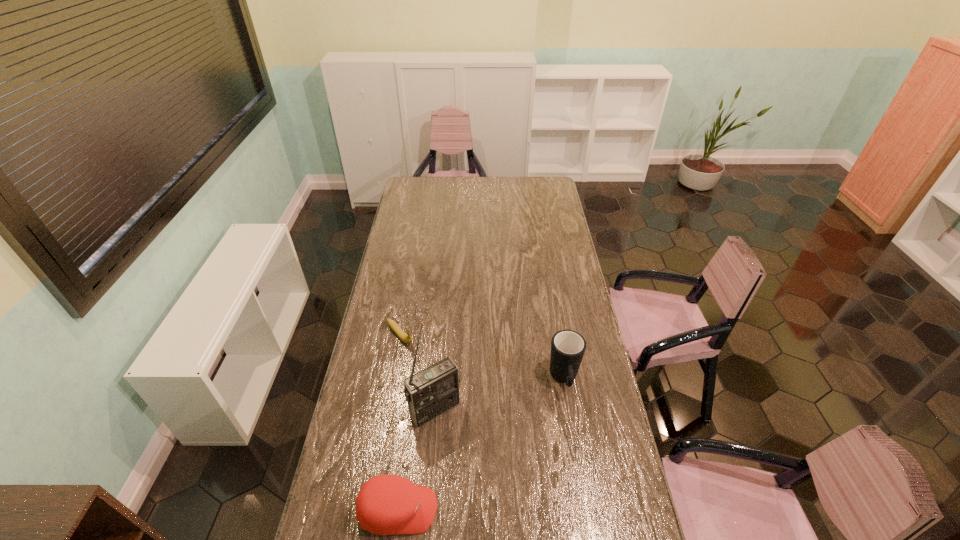
Where is `vacant space at the left edge`? vacant space at the left edge is located at coordinates (389, 271).

Find the location of a particular element. This screenshot has height=540, width=960. blank space at the right edge is located at coordinates (544, 269).

The width and height of the screenshot is (960, 540). I want to click on vacant area at the far left corner of the desktop, so click(x=426, y=194).

The width and height of the screenshot is (960, 540). Find the location of `free space at the near right corner`. free space at the near right corner is located at coordinates [605, 522].

The width and height of the screenshot is (960, 540). Identify the location of unoccupied area between the nearest object and the banana. (399, 422).

At what (x,y) coordinates should I click in order to perform the action: click on free space between the nearest object and the mug. Please return your answer as a coordinate pair (x, y). Looking at the image, I should click on (481, 444).

The height and width of the screenshot is (540, 960). Identify the location of free space between the second tallest object and the cap. (481, 444).

You are a GUI agent. You are given a task and a screenshot of the screen. Output one action in this format:
    pyautogui.click(x=<x>, y=<y>)
    Task: Click on the free point between the rightmost object and the nearest object
    
    Given the screenshot: What is the action you would take?
    point(481,444)

The height and width of the screenshot is (540, 960). In order to click on blank region between the radio receiver and the farthest object in this screenshot , I will do `click(418, 372)`.

The image size is (960, 540). In order to click on vacant area that lies between the cap and the rightmost object in this screenshot , I will do `click(481, 444)`.